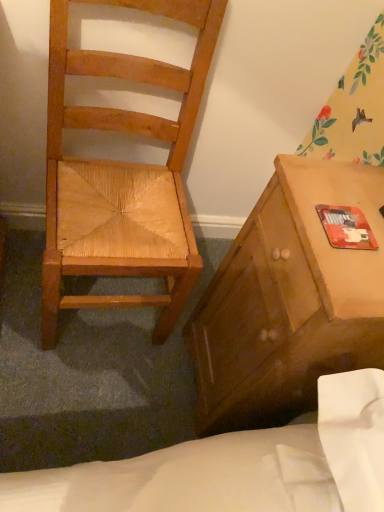
Question: Is matte wooden cabinet at right in front of or behind red matte mouse pad at right in the image?

Choices:
 (A) front
 (B) behind

Answer: (A)

Question: Is matte wooden cabinet at right wider or thinner than red matte mouse pad at right?

Choices:
 (A) thin
 (B) wide

Answer: (B)

Question: Estimate the real-world distances between objects in this image. Which object is closer to the red matte mouse pad at right?

Choices:
 (A) natural wood chair at left
 (B) matte wooden cabinet at right

Answer: (B)

Question: Which of these objects is positioned closest to the matte wooden cabinet at right?

Choices:
 (A) red matte mouse pad at right
 (B) natural wood chair at left

Answer: (A)